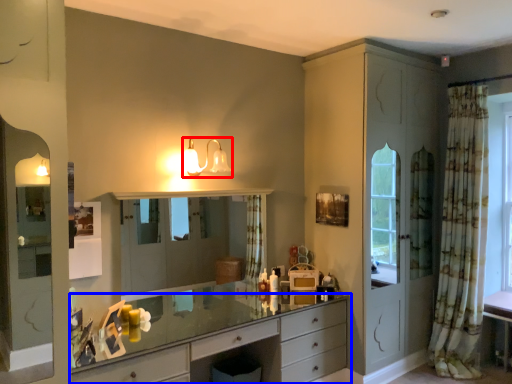
Question: Which object appears closest to the camera in this image, light fixture (highlighted by a red box) or chest of drawers (highlighted by a blue box)?

Choices:
 (A) light fixture
 (B) chest of drawers

Answer: (B)